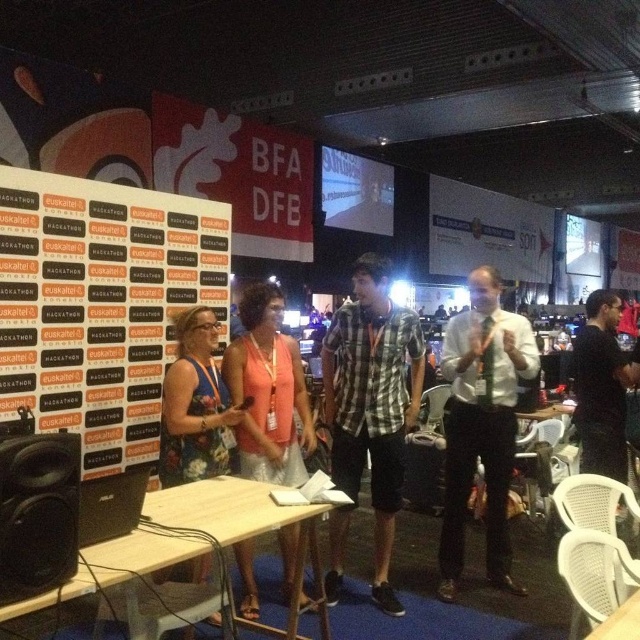
Question: Among these points, which one is farthest from the camera?

Choices:
 (A) (392, 397)
 (B) (20, 522)
 (C) (243, 416)

Answer: (A)

Question: Does white shirt at center appear on the right side of floral dress at center?

Choices:
 (A) no
 (B) yes

Answer: (B)

Question: Which point is closer to the camera?

Choices:
 (A) white shirt at center
 (B) orange fabric banner at left
 (C) orange fabric dress at center

Answer: (C)

Question: Does orange fabric banner at left appear on the left side of black matte speaker at lower left?

Choices:
 (A) yes
 (B) no

Answer: (A)

Question: Is orange fabric banner at left smaller than checkered fabric shirt at center?

Choices:
 (A) no
 (B) yes

Answer: (A)

Question: Considering the real-world distances, which object is closest to the orange fabric banner at left?

Choices:
 (A) checkered fabric shirt at center
 (B) wooden table at center
 (C) black matte speaker at lower left

Answer: (A)